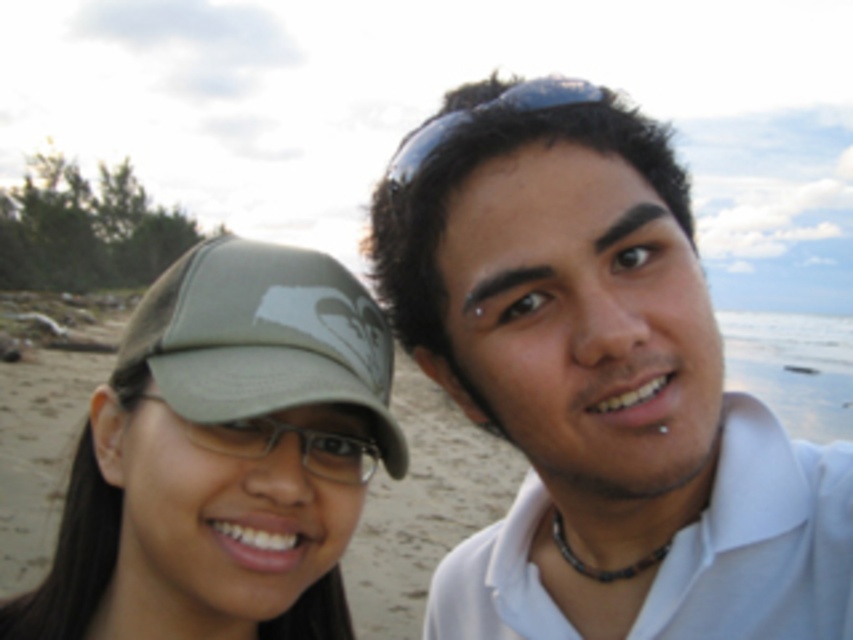
Between white matte shirt at center and matte khaki baseball cap at lower left, which one has more height?

With more height is white matte shirt at center.

Can you confirm if white matte shirt at center is positioned above matte khaki baseball cap at lower left?

Actually, white matte shirt at center is below matte khaki baseball cap at lower left.

Does point (737, 536) come closer to viewer compared to point (300, 256)?

Yes, it is in front of point (300, 256).

Where is `white matte shirt at center`? The width and height of the screenshot is (853, 640). white matte shirt at center is located at coordinates (598, 387).

Describe the element at coordinates (264, 337) in the screenshot. This screenshot has width=853, height=640. I see `matte khaki baseball cap at lower left` at that location.

Where is `matte khaki baseball cap at lower left`? The height and width of the screenshot is (640, 853). matte khaki baseball cap at lower left is located at coordinates (264, 337).

Is point (381, 381) behind point (541, 97)?

That is True.

The width and height of the screenshot is (853, 640). What are the coordinates of `matte khaki baseball cap at lower left` in the screenshot? It's located at (264, 337).

Between matte khaki cap at left and black rubber goggles at upper center, which one has less height?

With less height is black rubber goggles at upper center.

Is matte khaki cap at left above black rubber goggles at upper center?

No.

Which is behind, point (90, 618) or point (602, 93)?

The point (90, 618) is more distant.

This screenshot has height=640, width=853. I want to click on matte khaki cap at left, so click(224, 456).